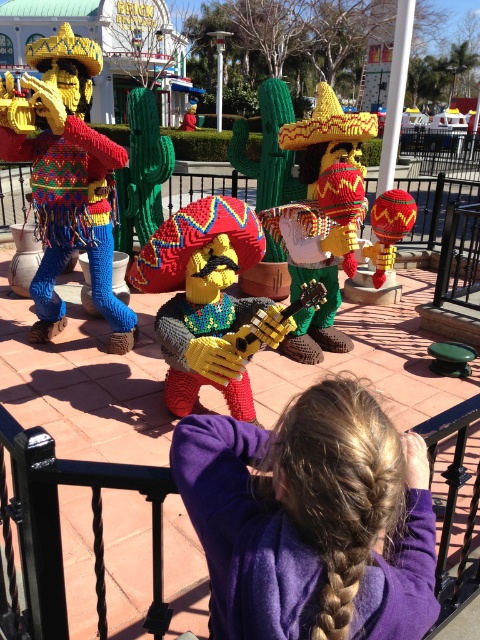
Where is the purple fleece jacket at lower center located in the image?

The purple fleece jacket at lower center is located at point (310, 520) in the image.